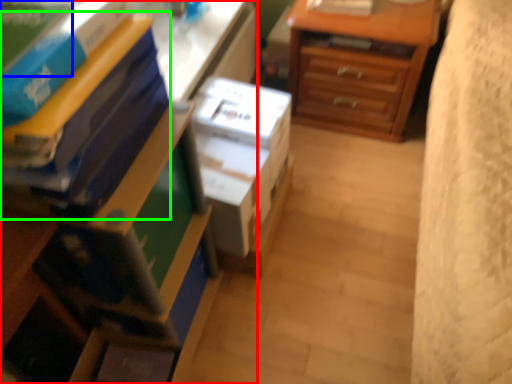
Question: Which object is positioned closest to nightstand (highlighted by a red box)? Select from paperback book (highlighted by a blue box) and paperback book (highlighted by a green box).

Choices:
 (A) paperback book
 (B) paperback book

Answer: (B)